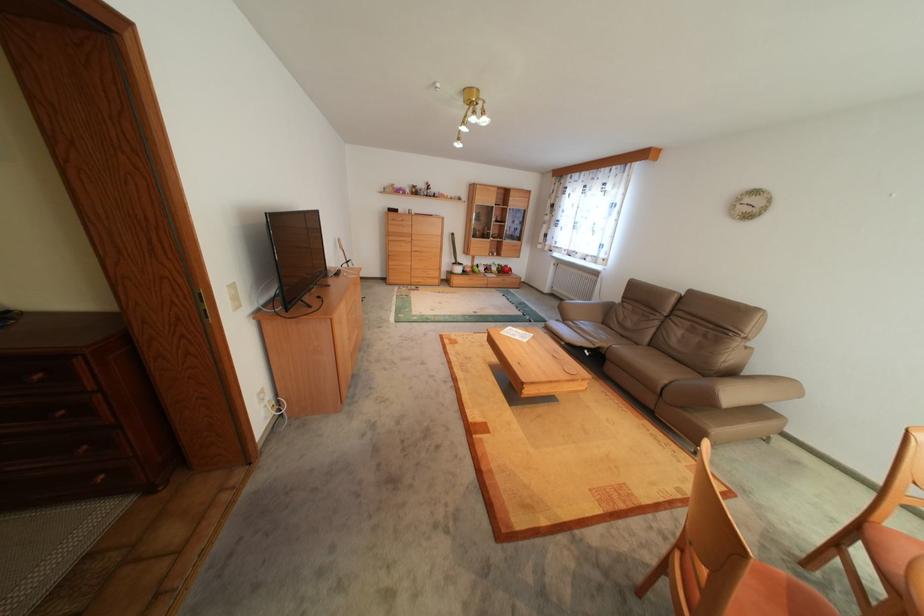
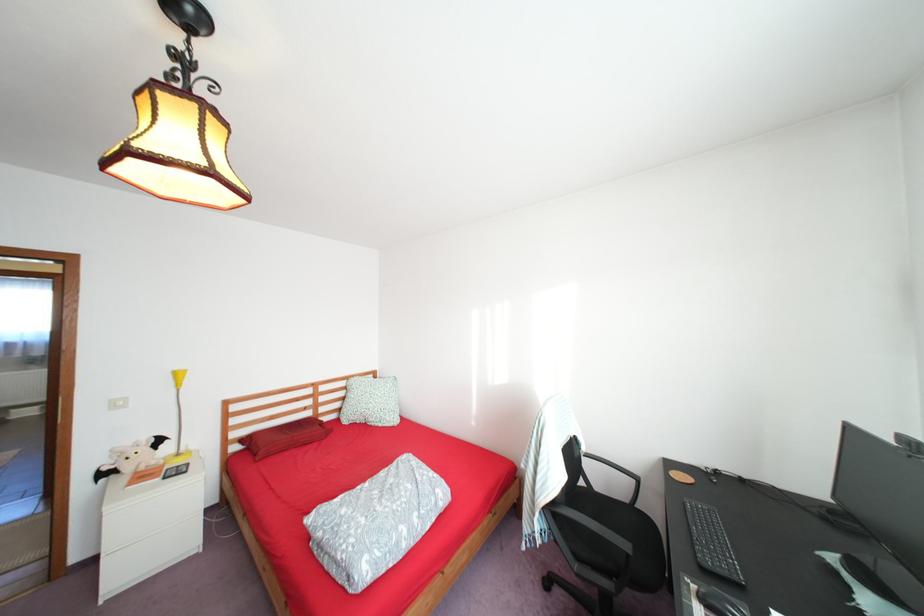
Question: I am providing you with two images of the same scene from different viewpoints. After the viewpoint changes to image2, which objects are now occluded?

Choices:
 (A) folded patterned blanket
 (B) potted cactus plant
 (C) multicolored art canvas
 (D) chair sitting surface

Answer: (B)